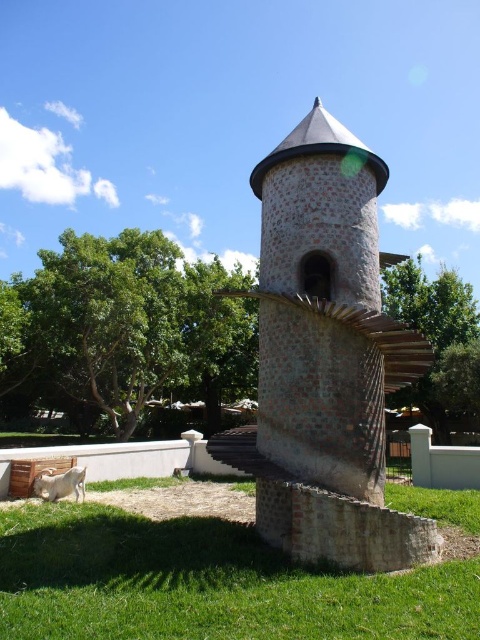
Identify the location of green leafy tree at upper left. coord(124,333).

Is green leafy tree at upper left taller than green leafy tree at upper right?

Yes, green leafy tree at upper left is taller than green leafy tree at upper right.

Does point (144, 388) come closer to viewer compared to point (424, 289)?

That is True.

The image size is (480, 640). I want to click on green leafy tree at upper left, so click(124, 333).

Does brown stone water tower at center appear under green leafy tree at upper left?

No, brown stone water tower at center is not below green leafy tree at upper left.

Does brown stone water tower at center appear on the left side of green leafy tree at upper left?

No, brown stone water tower at center is not to the left of green leafy tree at upper left.

Describe the element at coordinates (327, 356) in the screenshot. This screenshot has height=640, width=480. I see `brown stone water tower at center` at that location.

Identify the location of brown stone water tower at center. pyautogui.click(x=327, y=356).

From the picture: Does green grass at lower center appear over white woolen goat at lower left?

No.

Who is more distant from viewer, (195, 579) or (38, 476)?

The point (38, 476) is behind.

The width and height of the screenshot is (480, 640). What do you see at coordinates (217, 572) in the screenshot? I see `green grass at lower center` at bounding box center [217, 572].

Locate an element on the screen. This screenshot has height=640, width=480. green grass at lower center is located at coordinates (217, 572).